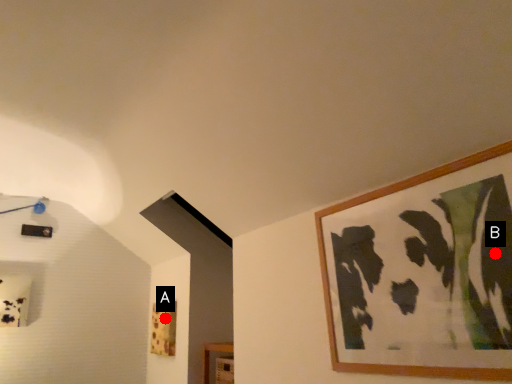
Question: Two points are circled on the image, labeled by A and B beside each circle. Which point is closer to the camera?

Choices:
 (A) A is closer
 (B) B is closer

Answer: (B)